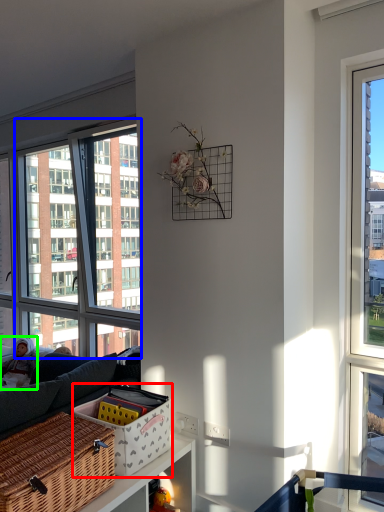
Question: Based on their relative distances, which object is nearer to basket (highlighted by a red box)? Choose from window (highlighted by a blue box) and couple (highlighted by a green box).

Choices:
 (A) window
 (B) couple

Answer: (B)